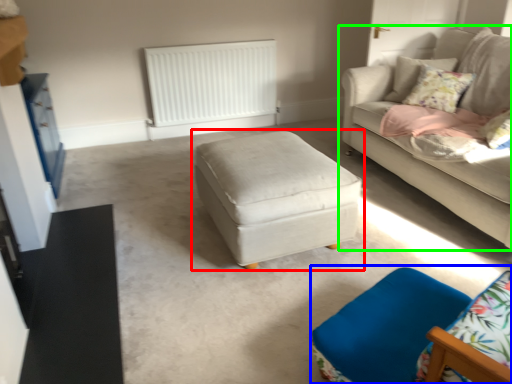
Question: Which is farther away from table (highlighted by a red box)? swivel chair (highlighted by a blue box) or studio couch (highlighted by a green box)?

Choices:
 (A) swivel chair
 (B) studio couch

Answer: (B)